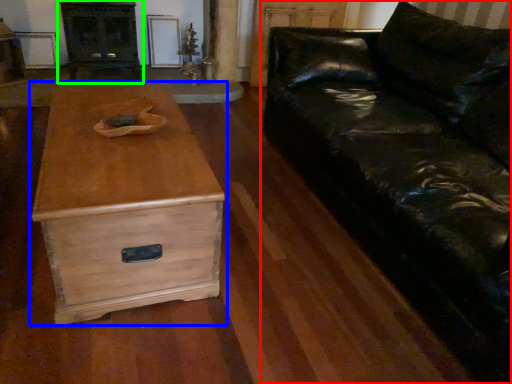
Question: Considering the real-world distances, which object is farthest from studio couch (highlighted by a red box)? chest of drawers (highlighted by a blue box) or entertainment center (highlighted by a green box)?

Choices:
 (A) chest of drawers
 (B) entertainment center

Answer: (B)